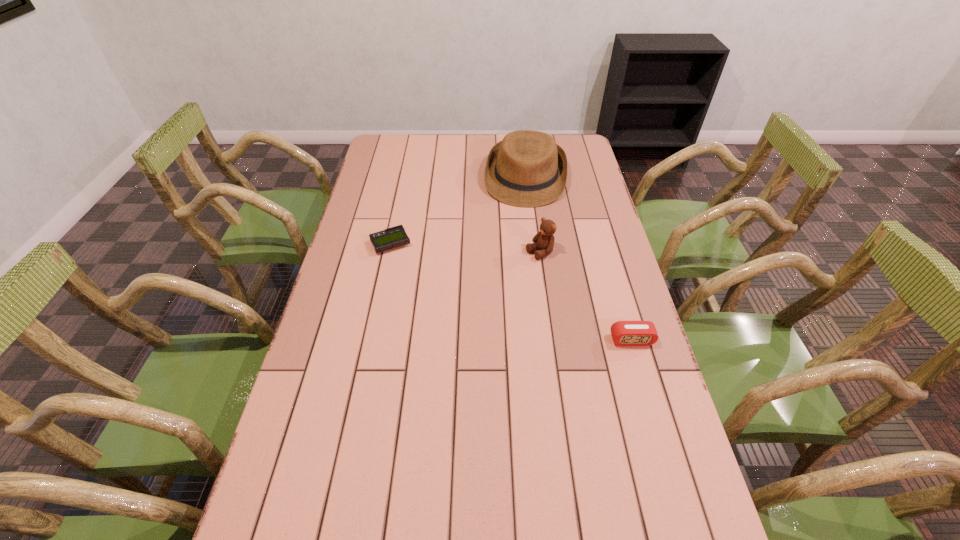
Locate an element on the screen. The width and height of the screenshot is (960, 540). vacant space on the desktop that is between the shortest object and the rightmost object and is positioned on the front-facing side of the fedora is located at coordinates (510, 292).

Where is `vacant space on the desktop that is between the beeper and the rightmost object and is positioned on the face of the teddy bear`? The image size is (960, 540). vacant space on the desktop that is between the beeper and the rightmost object and is positioned on the face of the teddy bear is located at coordinates (486, 282).